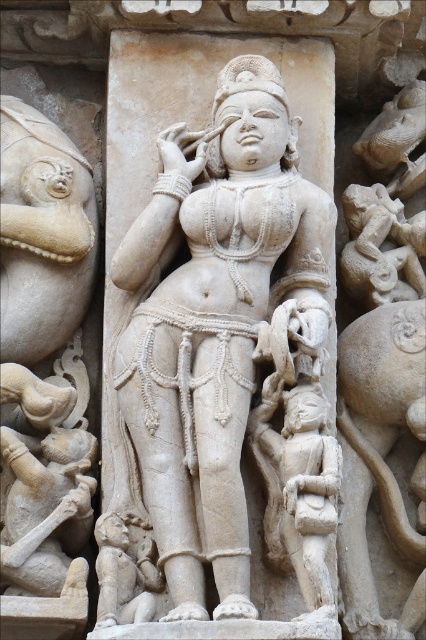
Can you confirm if carved stone figure at center is wider than white marble child at lower left?

Yes, carved stone figure at center is wider than white marble child at lower left.

Between point (302, 449) and point (118, 579), which one is positioned in front?

Point (302, 449) is more forward.

Locate an element on the screen. The width and height of the screenshot is (426, 640). carved stone figure at center is located at coordinates (298, 486).

From the picture: Who is shorter, white marble statue at center or white marble child at lower left?

white marble child at lower left

Is white marble statue at center above white marble child at lower left?

Yes.

Between point (186, 520) and point (149, 564), which one is positioned in front?

Point (186, 520) is more forward.

You are a GUI agent. You are given a task and a screenshot of the screen. Output one action in this format:
    pyautogui.click(x=<x>, y=<y>)
    Task: Click on the white marble statue at center
    The width and height of the screenshot is (426, 640).
    Given the screenshot: What is the action you would take?
    pyautogui.click(x=230, y=355)

Which is above, white marble statue at center or carved stone figure at center?

Positioned higher is white marble statue at center.

Between white marble statue at center and carved stone figure at center, which one has less height?

carved stone figure at center

Does point (131, 470) lie behind point (304, 410)?

Yes, point (131, 470) is behind point (304, 410).

This screenshot has width=426, height=640. I want to click on white marble statue at center, so click(230, 355).